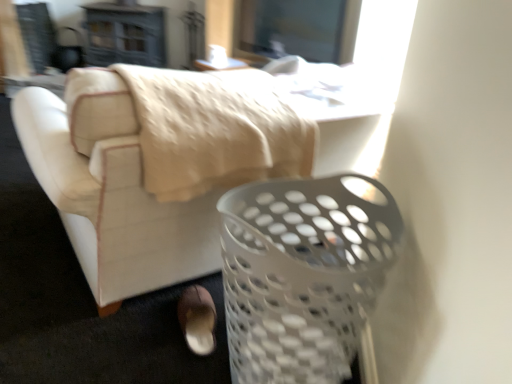
I want to click on white plastic basket at lower right, so click(303, 274).

Who is shorter, white plastic laundry basket at lower right or white plastic basket at lower right?

white plastic laundry basket at lower right.

Does white plastic laundry basket at lower right lie behind white plastic basket at lower right?

Yes, white plastic laundry basket at lower right is further from the viewer.

Looking at this image, how different are the orientations of white plastic laundry basket at lower right and white plastic basket at lower right in degrees?

3.85 degrees separate the facing orientations of white plastic laundry basket at lower right and white plastic basket at lower right.

How distant is white plastic laundry basket at lower right from white plastic basket at lower right?

16.49 inches.

Consider the image. From the image's perspective, relative to white plastic laundry basket at lower right, is white plastic basket at lower right above or below?

Based on their image positions, white plastic basket at lower right is located beneath white plastic laundry basket at lower right.

Which object is closer to the camera taking this photo, white plastic basket at lower right or white plastic laundry basket at lower right?

white plastic basket at lower right is in front.

Would you say white plastic basket at lower right is a long distance from white plastic laundry basket at lower right?

white plastic basket at lower right is near white plastic laundry basket at lower right, not far away.

From a real-world perspective, which is physically above, white plastic basket at lower right or white plastic laundry basket at lower right?

In real-world perspective, white plastic laundry basket at lower right is above.

Is brown suede shoe at lower center next to white plastic basket at lower right?

brown suede shoe at lower center is not next to white plastic basket at lower right, and they're not touching.

Considering the positions of objects brown suede shoe at lower center and white plastic basket at lower right in the image provided, who is in front, brown suede shoe at lower center or white plastic basket at lower right?

white plastic basket at lower right.

Is brown suede shoe at lower center oriented away from white plastic basket at lower right?

Yes, white plastic basket at lower right is at the back of brown suede shoe at lower center.

You are a GUI agent. You are given a task and a screenshot of the screen. Output one action in this format:
    pyautogui.click(x=<x>, y=<y>)
    Task: Click on the basket lying above the brown suede shoe at lower center (from the image's perspective)
    The width and height of the screenshot is (512, 384).
    Given the screenshot: What is the action you would take?
    pyautogui.click(x=303, y=274)

Who is more distant, white plastic table at upper center or white plastic laundry basket at lower right?

white plastic table at upper center is further from the camera.

From the picture: Considering the sizes of objects white plastic table at upper center and white plastic laundry basket at lower right in the image provided, who is thinner, white plastic table at upper center or white plastic laundry basket at lower right?

white plastic table at upper center is thinner.

Is white plastic table at upper center in contact with white plastic laundry basket at lower right?

No, white plastic table at upper center is not making contact with white plastic laundry basket at lower right.

Can you confirm if white plastic laundry basket at lower right is positioned to the left of brown suede shoe at lower center?

In fact, white plastic laundry basket at lower right is to the right of brown suede shoe at lower center.

Is white plastic laundry basket at lower right facing away from brown suede shoe at lower center?

white plastic laundry basket at lower right does not have its back to brown suede shoe at lower center.

Which of these two, white plastic laundry basket at lower right or brown suede shoe at lower center, is smaller?

Smaller between the two is brown suede shoe at lower center.

Can you confirm if brown suede shoe at lower center is taller than white plastic table at upper center?

Yes.

Which object is closer to the camera taking this photo, brown suede shoe at lower center or white plastic table at upper center?

brown suede shoe at lower center is closer to the camera.

Considering the sizes of objects brown suede shoe at lower center and white plastic table at upper center in the image provided, who is thinner, brown suede shoe at lower center or white plastic table at upper center?

Thinner between the two is brown suede shoe at lower center.

From the image's perspective, between brown suede shoe at lower center and white plastic table at upper center, who is located below?

brown suede shoe at lower center.

Is white plastic basket at lower right bigger or smaller than brown suede shoe at lower center?

In the image, white plastic basket at lower right appears to be larger than brown suede shoe at lower center.

From the picture: From a real-world perspective, is white plastic basket at lower right over brown suede shoe at lower center?

Indeed, from a real-world perspective, white plastic basket at lower right stands above brown suede shoe at lower center.

Which of these two, white plastic basket at lower right or brown suede shoe at lower center, is wider?

Wider between the two is white plastic basket at lower right.

Where is `basket that appears below the white plastic laundry basket at lower right (from the image's perspective)`? This screenshot has height=384, width=512. basket that appears below the white plastic laundry basket at lower right (from the image's perspective) is located at coordinates (303, 274).

Find the location of a particular element. This screenshot has width=512, height=384. furniture that is on the left side of white plastic basket at lower right is located at coordinates (112, 191).

From the picture: Looking at the image, which one is located further to white plastic table at upper center, white plastic basket at lower right or white plastic laundry basket at lower right?

white plastic basket at lower right is positioned further to the anchor white plastic table at upper center.

Considering their positions, is white plastic table at upper center positioned further to white plastic laundry basket at lower right than white plastic basket at lower right?

Based on the image, white plastic table at upper center appears to be further to white plastic laundry basket at lower right.

Considering their positions, is white plastic table at upper center positioned further to brown suede shoe at lower center than white plastic laundry basket at lower right?

white plastic table at upper center.

When comparing their distances from white plastic table at upper center, does white plastic basket at lower right or brown suede shoe at lower center seem further?

white plastic basket at lower right lies further to white plastic table at upper center than the other object.

When comparing their distances from white plastic basket at lower right, does brown suede shoe at lower center or white plastic table at upper center seem further?

Among the two, white plastic table at upper center is located further to white plastic basket at lower right.

Based on their spatial positions, is white plastic basket at lower right or white plastic table at upper center further from brown suede shoe at lower center?

white plastic table at upper center is further to brown suede shoe at lower center.

Which object lies further to the anchor point brown suede shoe at lower center, white plastic table at upper center or white plastic basket at lower right?

The object further to brown suede shoe at lower center is white plastic table at upper center.

Which object lies nearer to the anchor point brown suede shoe at lower center, white plastic laundry basket at lower right or white plastic basket at lower right?

white plastic laundry basket at lower right is positioned closer to the anchor brown suede shoe at lower center.

This screenshot has width=512, height=384. What are the coordinates of `basket between white plastic laundry basket at lower right and brown suede shoe at lower center in the vertical direction` in the screenshot? It's located at 303,274.

Identify the location of footwear between white plastic laundry basket at lower right and white plastic table at upper center along the z-axis. click(x=197, y=319).

This screenshot has width=512, height=384. I want to click on footwear between white plastic basket at lower right and white plastic table at upper center from front to back, so pyautogui.click(x=197, y=319).

You are a GUI agent. You are given a task and a screenshot of the screen. Output one action in this format:
    pyautogui.click(x=<x>, y=<y>)
    Task: Click on the furniture between white plastic basket at lower right and white plastic table at upper center in the front-back direction
    The height and width of the screenshot is (384, 512).
    Given the screenshot: What is the action you would take?
    pyautogui.click(x=112, y=191)